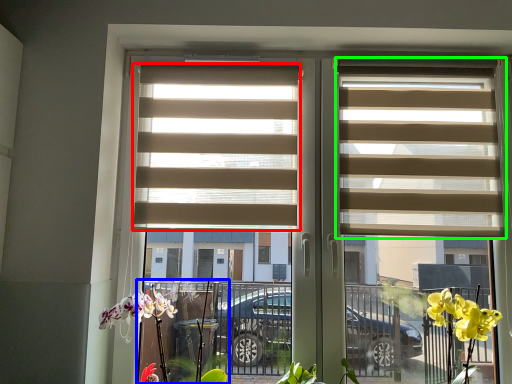
Question: Considering the real-world distances, which object is farthest from window blind (highlighted by a red box)? plant (highlighted by a blue box) or window blind (highlighted by a green box)?

Choices:
 (A) plant
 (B) window blind

Answer: (A)